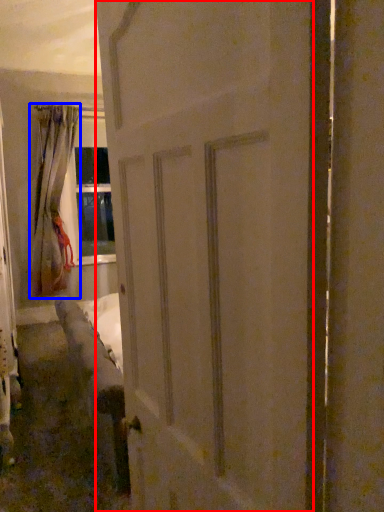
Question: Among these objects, which one is farthest to the camera, door (highlighted by a red box) or curtain (highlighted by a blue box)?

Choices:
 (A) door
 (B) curtain

Answer: (B)